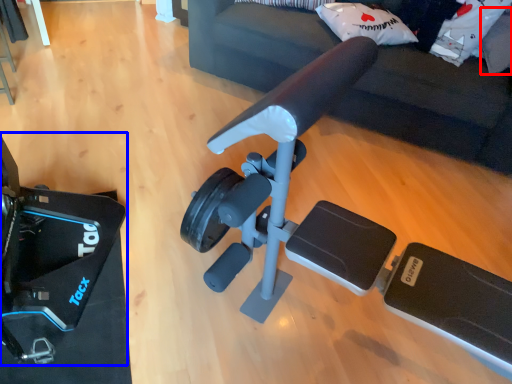
Question: Which of the following is the closest to the observer, pillow (highlighted by a red box) or video camera (highlighted by a blue box)?

Choices:
 (A) pillow
 (B) video camera

Answer: (B)